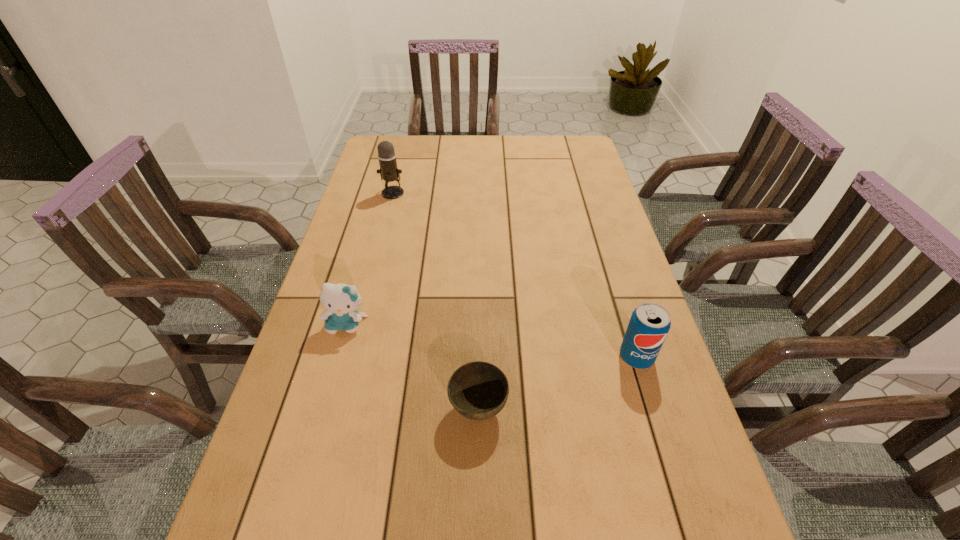
Where is `blank area in the image that satisfies the following two spatial constraints: 1. on the front side of the rightmost object; 2. on the left side of the tallest object`? blank area in the image that satisfies the following two spatial constraints: 1. on the front side of the rightmost object; 2. on the left side of the tallest object is located at coordinates (351, 357).